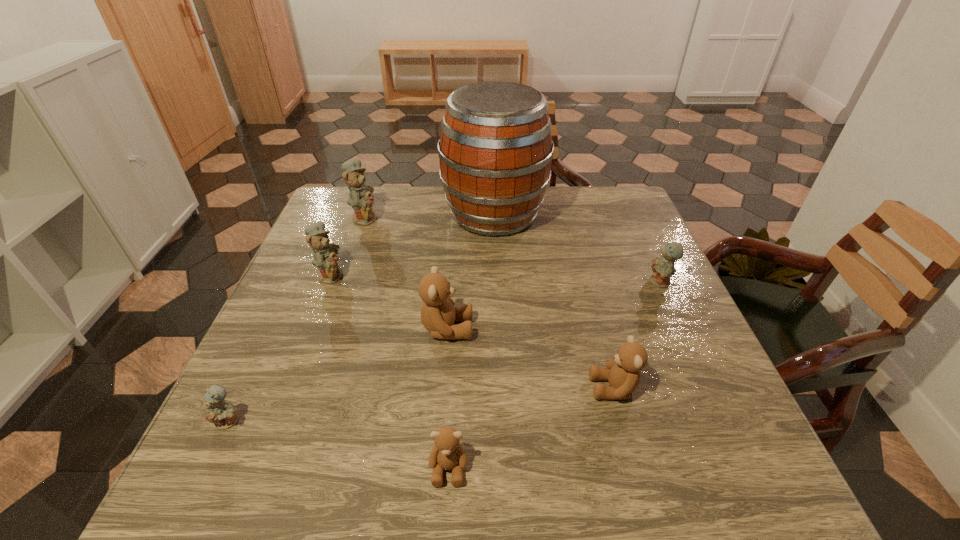
Locate an element on the screen. the tallest object is located at coordinates (495, 150).

Where is `the biggest blue teddy bear`? the biggest blue teddy bear is located at coordinates pos(360,198).

You are a GUI agent. You are given a task and a screenshot of the screen. Output one action in this format:
    pyautogui.click(x=<x>, y=<y>)
    Task: Click on the farthest blue teddy bear
    The width and height of the screenshot is (960, 540).
    Given the screenshot: What is the action you would take?
    pyautogui.click(x=360, y=198)

Locate an element on the screen. the third smallest blue teddy bear is located at coordinates coord(325,258).

Identify the location of the biggest brown teddy bear. (438, 314).

This screenshot has height=540, width=960. In order to click on the fourth farthest teddy bear in this screenshot , I will do `click(438, 314)`.

Find the location of a particular element. The image size is (960, 540). the rightmost blue teddy bear is located at coordinates (663, 267).

Identify the location of the rightmost teddy bear. This screenshot has width=960, height=540. (663, 267).

You are a GUI agent. You are given a task and a screenshot of the screen. Output one action in this format:
    pyautogui.click(x=<x>, y=<y>)
    Task: Click on the second biggest brown teddy bear
    
    Given the screenshot: What is the action you would take?
    pyautogui.click(x=623, y=372)

I want to click on the second farthest brown teddy bear, so pyautogui.click(x=623, y=372).